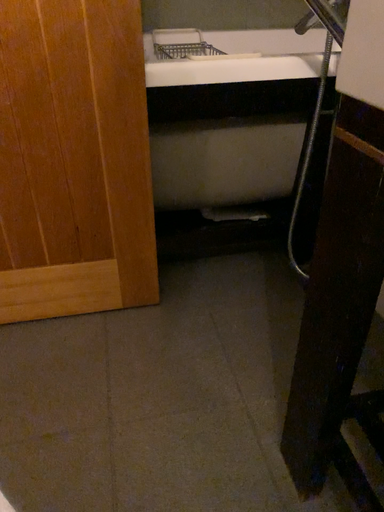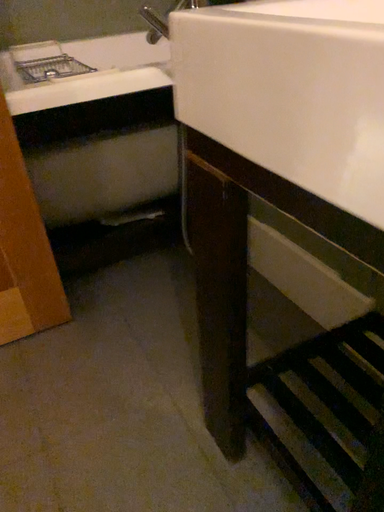
Question: How did the camera likely rotate when shooting the video?

Choices:
 (A) rotated right
 (B) rotated left

Answer: (A)